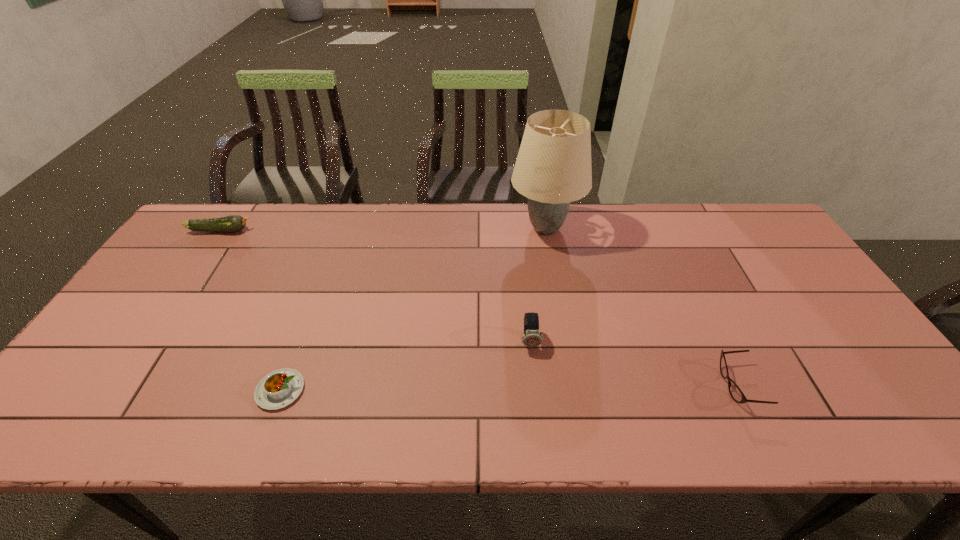
Where is `empty space that is in between the rightmost object and the pudding`? empty space that is in between the rightmost object and the pudding is located at coordinates [x=510, y=388].

Where is `vacant point located between the rightmost object and the zucchini`? vacant point located between the rightmost object and the zucchini is located at coordinates (480, 308).

Where is `vacant region between the lampshade and the pudding`? vacant region between the lampshade and the pudding is located at coordinates (413, 309).

This screenshot has height=540, width=960. In order to click on free space between the second object from left to right and the leftmost object in this screenshot , I will do `click(251, 310)`.

You are a GUI agent. You are given a task and a screenshot of the screen. Output one action in this format:
    pyautogui.click(x=<x>, y=<y>)
    Task: Click on the free point between the leftmost object and the pudding
    
    Given the screenshot: What is the action you would take?
    pyautogui.click(x=251, y=310)

Identify which object is the nearest to the leftmost object. Please provide its 2D coordinates. Your answer should be formatted as a tuple, i.e. [(x, y)], where the tuple contains the x and y coordinates of a point satisfying the conditions above.

[(276, 390)]

Point out which object is positioned as the nearest to the zucchini. Please provide its 2D coordinates. Your answer should be formatted as a tuple, i.e. [(x, y)], where the tuple contains the x and y coordinates of a point satisfying the conditions above.

[(276, 390)]

Identify the location of vacant area in the image that satisfies the following two spatial constraints: 1. at the blossom end of the zucchini; 2. on the back side of the pudding. The width and height of the screenshot is (960, 540). (112, 390).